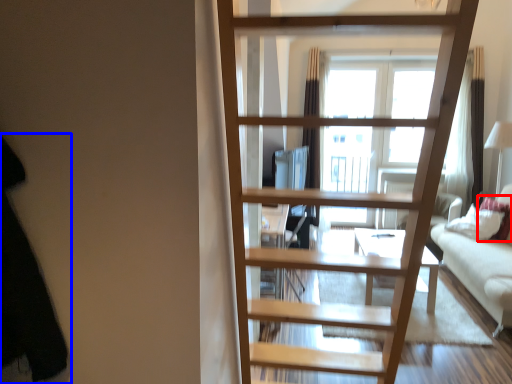
Question: Among these objects, which one is farthest to the camera, pillow (highlighted by a red box) or dark (highlighted by a blue box)?

Choices:
 (A) pillow
 (B) dark

Answer: (A)